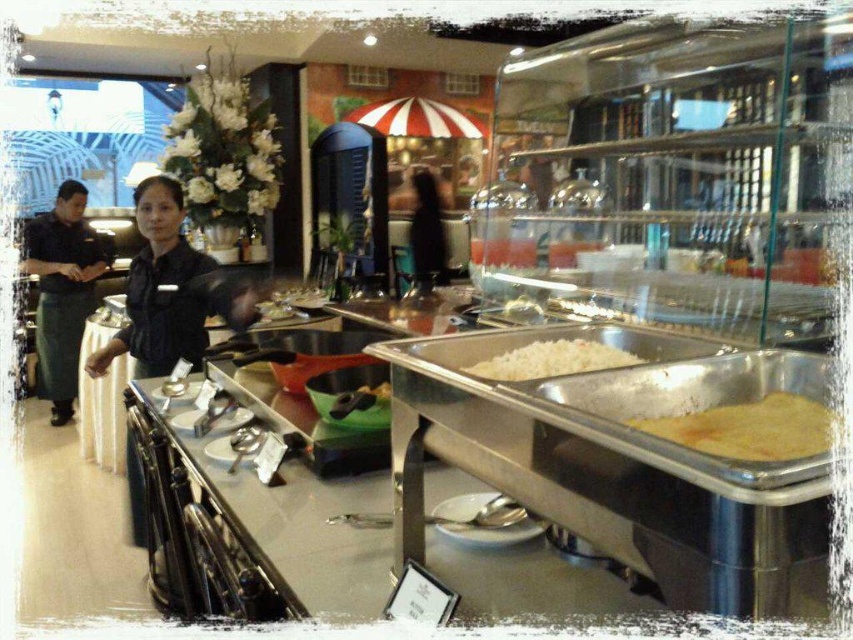
You are a guest at the buffet and want to serve yourself the yellow matte pancake at right. However, there is a staff member in the black uniform at center blocking your path. Can you reach the pancake without moving the staff member?

The black uniform at center is positioned over the yellow matte pancake at right, meaning the staff member is directly in front of it. You would need to ask them to step aside or find an alternative path around them to access the pancake.

You are a guest at the buffet and want to ask a staff member for assistance. You see two staff members wearing black uniform at center and black uniform at left. Which staff member is closer to you?

The black uniform at center is closer to you since it is positioned in the center of the scene, whereas the black uniform at left is further back in the midground. However, according to the description, the distance between them is 2.16 meters, so you can approach either one for help.